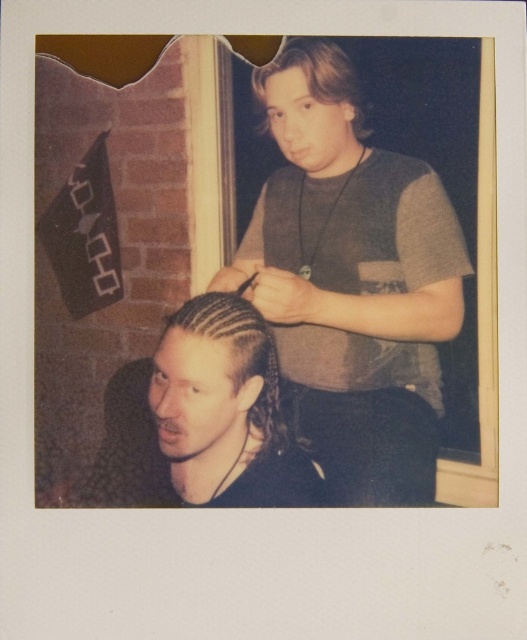
You are a photographer trying to capture a closeup of the gray fabric shirt at upper center and the light brown wavy hair at upper center in the Polaroid photo. Which object should you focus on first if you want to ensure both are in focus without adjusting the camera settings?

The gray fabric shirt at upper center is larger in size than the light brown wavy hair at upper center, so you should focus on the gray fabric shirt at upper center first since it is bigger and will be easier to focus on.

You are standing in the barbershop shown in the Polaroid photo. You notice two points marked in the image. According to their positions, which point is closer to you, point (x=338, y=349) or point (x=264, y=392)?

Point (x=264, y=392) is closer to you because it has a lower y coordinate than point (x=338, y=349), meaning it is positioned higher up in the image, which typically corresponds to being nearer to the viewer in such photographs.

You are a customer in a barbershop and you want to know if the gray fabric shirt at upper center is taller than the black braided hair at center. Can you confirm this?

The gray fabric shirt at upper center has a greater height compared to the black braided hair at center, so yes, the gray fabric shirt at upper center is taller than the black braided hair at center.